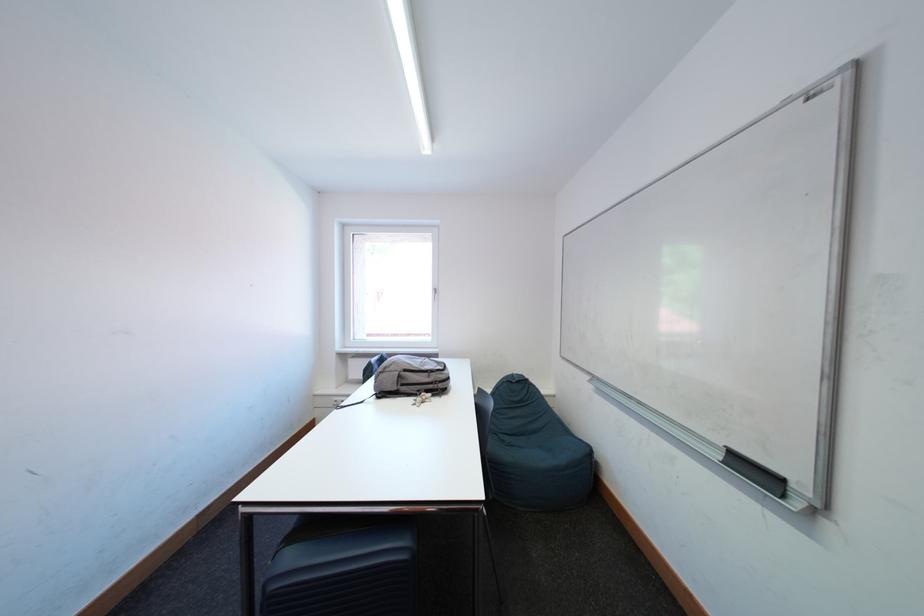
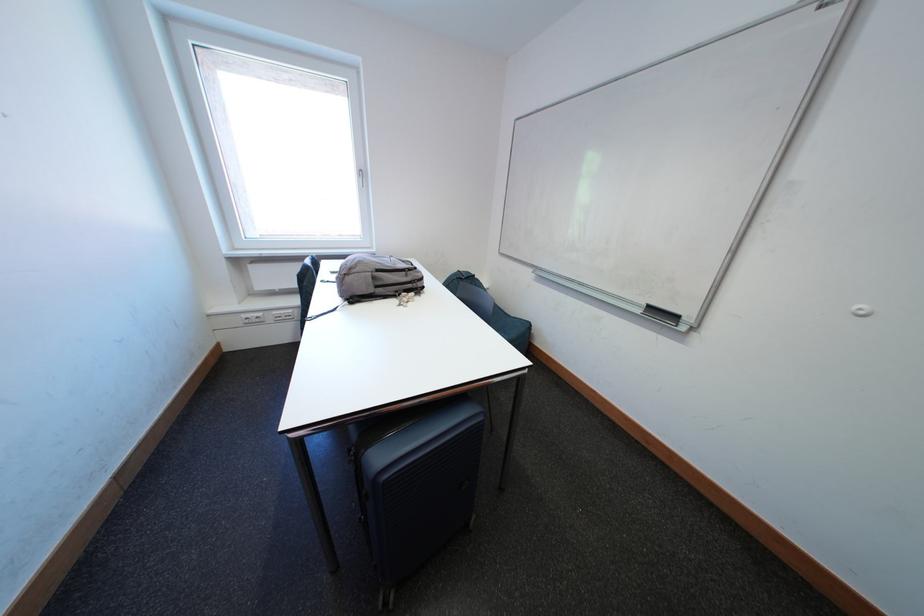
Where in the second image is the point corresponding to (x=428, y=394) from the first image?

(406, 294)